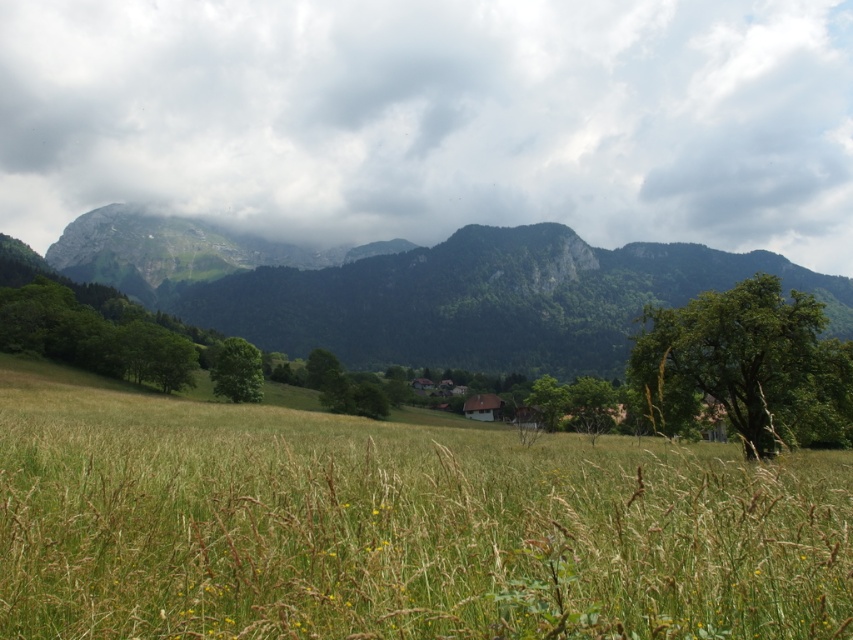
Question: Observing the image, what is the correct spatial positioning of green leafy tree at right in reference to green matte tree at center?

Choices:
 (A) left
 (B) right

Answer: (B)

Question: Based on their relative distances, which object is nearer to the green matte tree at center?

Choices:
 (A) green grass at center
 (B) green rocky mountain at center
 (C) green leafy tree at right
 (D) green leafy tree at center

Answer: (D)

Question: Is green grass at center below green rocky mountain at center?

Choices:
 (A) yes
 (B) no

Answer: (A)

Question: Among these points, which one is farthest from the camera?

Choices:
 (A) (250, 140)
 (B) (350, 342)
 (C) (306, 369)
 (D) (223, 376)

Answer: (A)

Question: Is green grass at center smaller than green leafy tree at center?

Choices:
 (A) yes
 (B) no

Answer: (B)

Question: Estimate the real-world distances between objects in this image. Which object is farther from the green rocky mountain at center?

Choices:
 (A) green grass at center
 (B) green matte tree at center

Answer: (B)